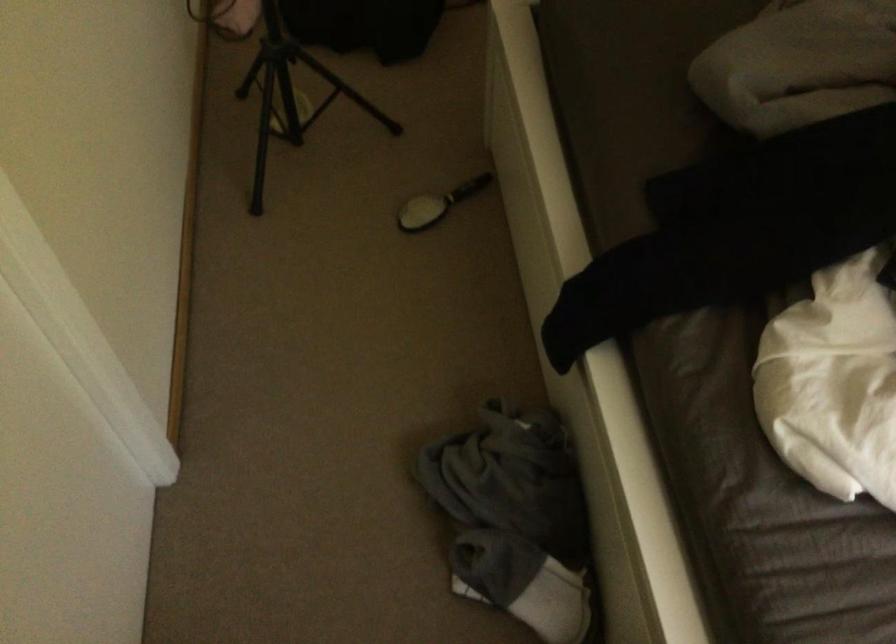
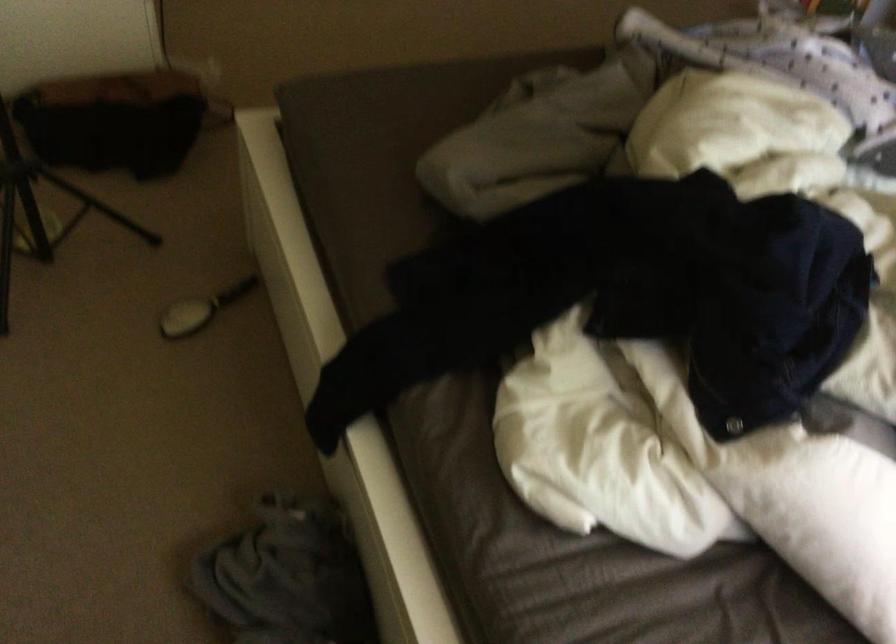
In a continuous first-person perspective shot, in which direction is the camera moving?

The cameraman moved toward right, backward.